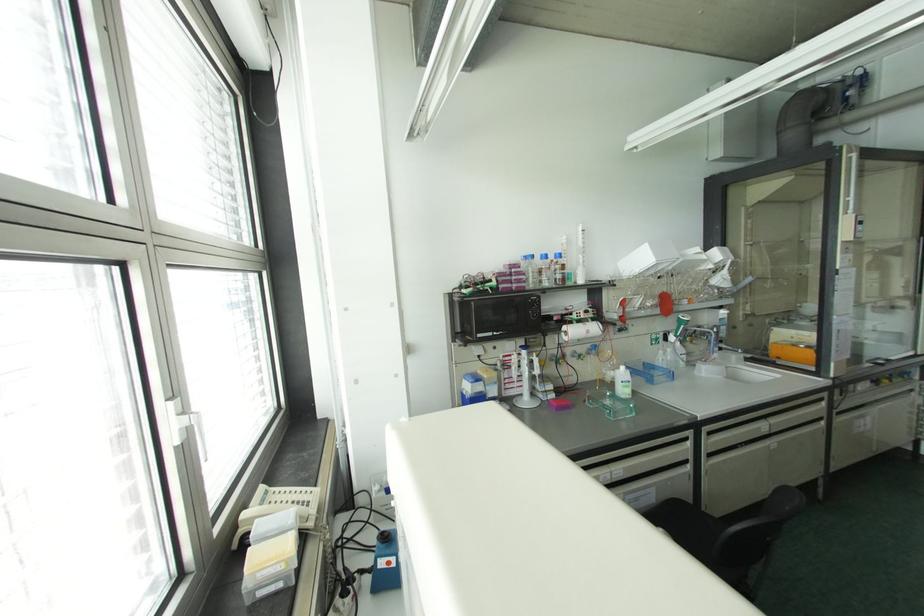
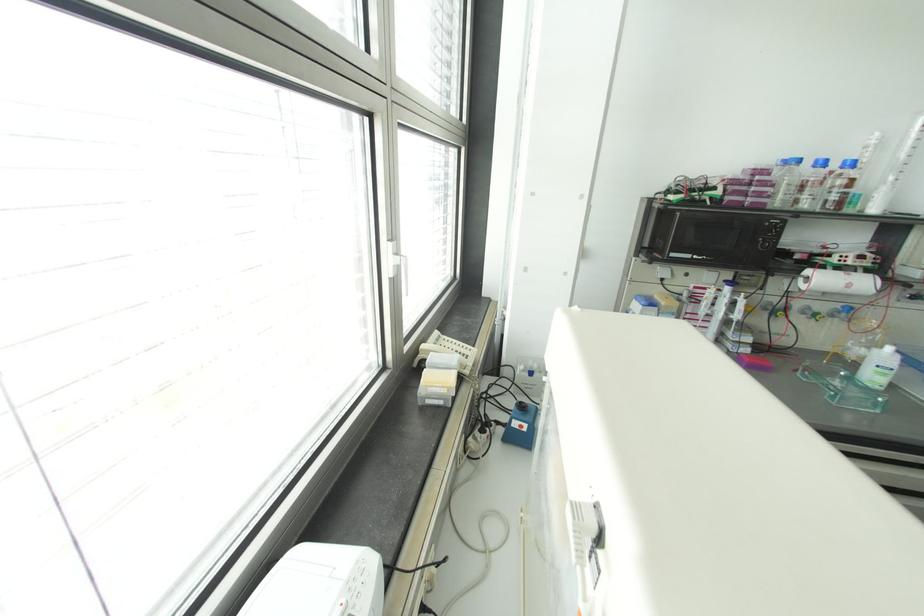
The point at (537,371) is marked in the first image. Where is the corresponding point in the second image?

(736, 315)